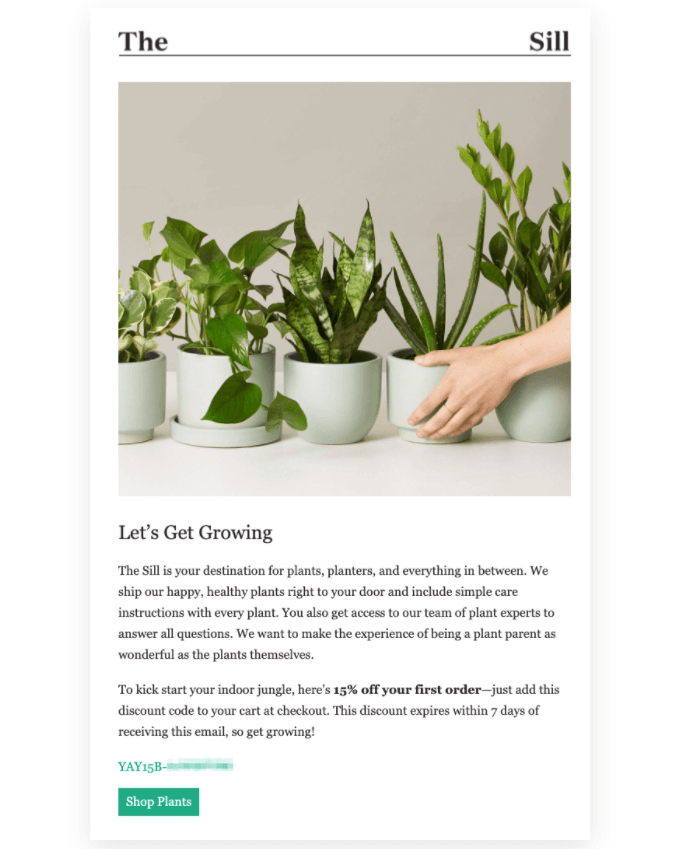
The image size is (685, 849). In order to click on below flower pots in this screenshot , I will do `click(140, 464)`, `click(221, 468)`, `click(327, 473)`, `click(477, 473)`, `click(542, 464)`, `click(406, 467)`.